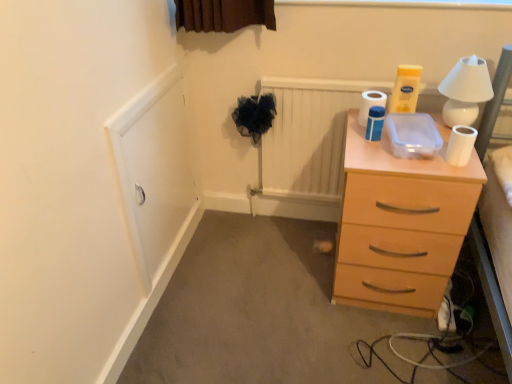
Locate an element on the screen. free location to the right of white matte toilet paper at upper right, the third toilet paper in the right-to-left sequence is located at coordinates (419, 135).